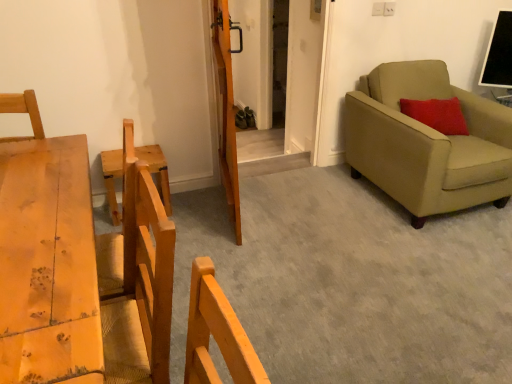
The height and width of the screenshot is (384, 512). In order to click on vacant area that is in front of wooden door at center in this screenshot , I will do `click(246, 246)`.